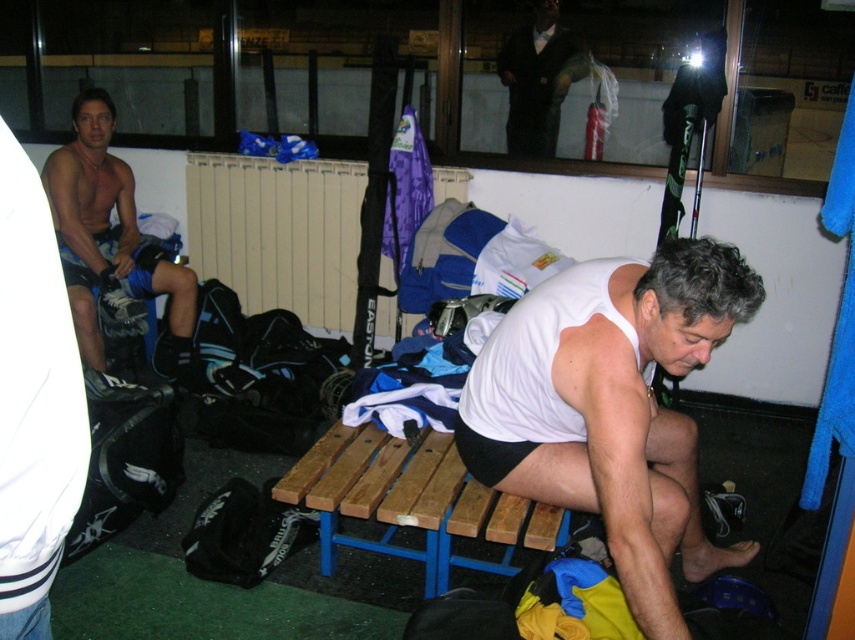
You are an athlete in the locker room. You see two pairs of shorts, the black fabric shorts at left and the matte black shorts at left. Which pair is closer to the right side of the locker room?

The black fabric shorts at left is positioned on the right side of matte black shorts at left, so the black fabric shorts at left is closer to the right side of the locker room.

You are an athlete preparing for a game and need to choose between the black fabric shorts at left and the matte black shorts at left. Which pair is more suitable if you want something that won

The black fabric shorts at left is smaller than matte black shorts at left, so if you want something that fits more snugly or requires a smaller size, the black fabric shorts at left would be more suitable.

You are an athlete in the locker room. You see two pairs of shorts at left. Which one is closer to you, the black fabric shorts at left or the matte black shorts at left?

The black fabric shorts at left is closer to you because it is in front of the matte black shorts at left.